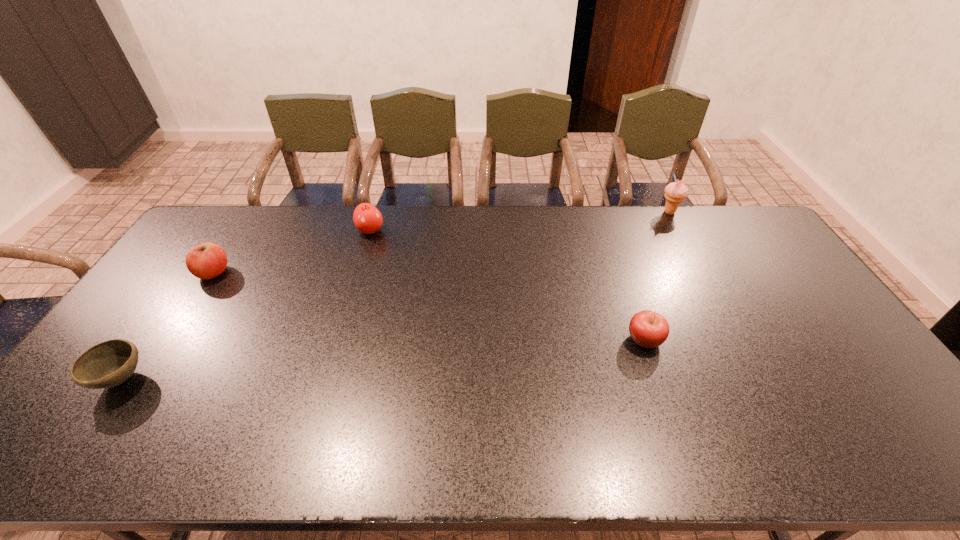
The height and width of the screenshot is (540, 960). Find the location of `vacant space situated on the left of the farthest object`. vacant space situated on the left of the farthest object is located at coordinates (637, 212).

The image size is (960, 540). I want to click on vacant space located 0.260m on the left of the second apple from left to right, so click(285, 231).

Find the location of `vacant space situated 0.330m on the front of the leftmost apple`. vacant space situated 0.330m on the front of the leftmost apple is located at coordinates (149, 372).

Find the location of a particular element. This screenshot has height=540, width=960. blank space located 0.230m on the right of the rightmost apple is located at coordinates (745, 340).

You are a GUI agent. You are given a task and a screenshot of the screen. Output one action in this format:
    pyautogui.click(x=<x>, y=<y>)
    Task: Click on the vacant space located on the right of the bowl
    This screenshot has height=540, width=960.
    Given the screenshot: What is the action you would take?
    pyautogui.click(x=186, y=379)

The image size is (960, 540). Identify the location of icecream that is at the far edge. (676, 192).

In order to click on apple that is at the far edge in this screenshot , I will do `click(367, 218)`.

The height and width of the screenshot is (540, 960). What are the coordinates of `apple that is at the left edge` in the screenshot? It's located at (208, 260).

What are the coordinates of `bowl that is at the left edge` in the screenshot? It's located at (110, 363).

The image size is (960, 540). Identify the location of vacant space at the far edge. (276, 239).